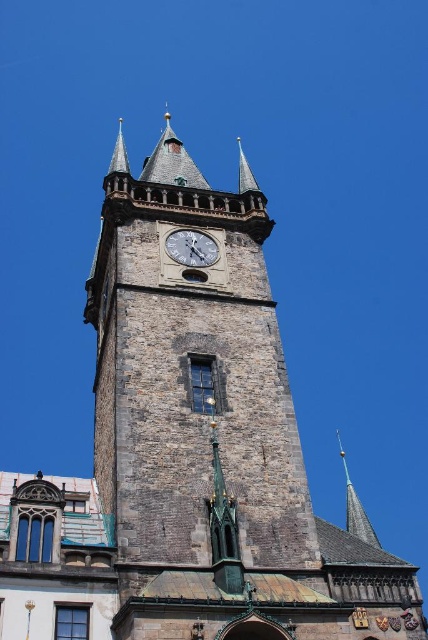
You are an architect examining the tower. You need to determine the vertical arrangement of the silver metallic clock at center and the shiny gold spire at upper center. Which one is positioned higher on the tower?

The silver metallic clock at center is located above the shiny gold spire at upper center, meaning the clock is higher up on the tower.

You are an architect assessing the tower for restoration. You need to determine which object, the silver metallic clock at center or the shiny gold spire at upper center, requires more material for its restoration due to its size. Based on the image, which one would need more material?

The shiny gold spire at upper center requires more material for restoration because it occupies more space than the silver metallic clock at center.

You are an architect inspecting the historic stone tower. You notice the silver metallic clock at center and the shiny gold spire at upper center. Which object is located to the right of the other?

The shiny gold spire at upper center is located to the right of the silver metallic clock at center.